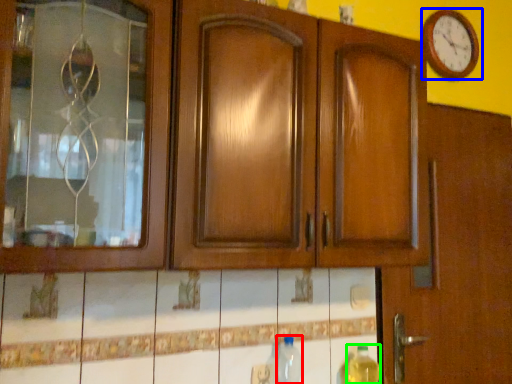
Question: Which is nearer to the bottle (highlighted by a red box)? wall clock (highlighted by a blue box) or bottle (highlighted by a green box).

Choices:
 (A) wall clock
 (B) bottle

Answer: (B)